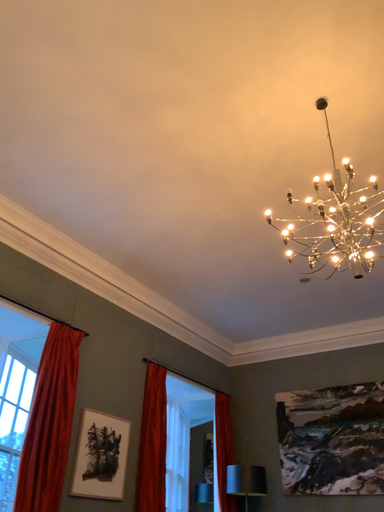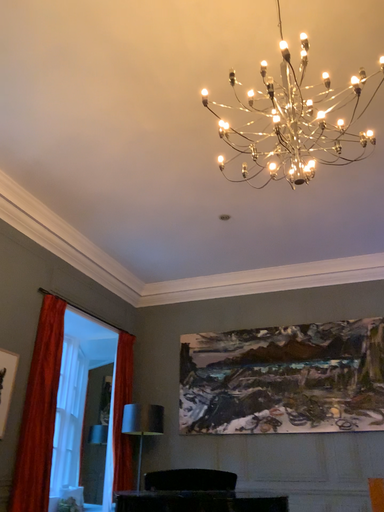
Question: Which way did the camera rotate in the video?

Choices:
 (A) rotated downward
 (B) rotated upward

Answer: (A)